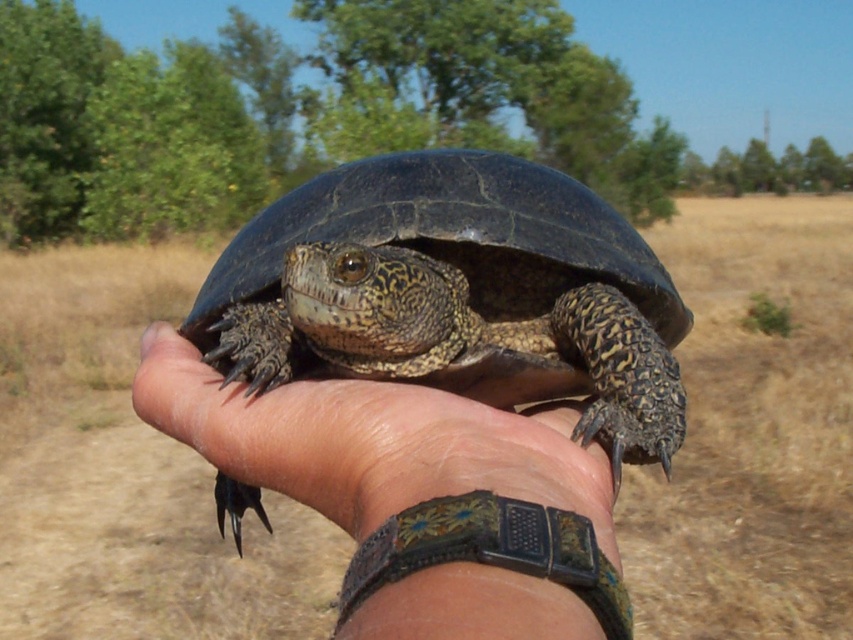
Is shiny dark shell turtle at center closer to the viewer compared to leather wristwatch at center?

No, it is not.

The width and height of the screenshot is (853, 640). I want to click on shiny dark shell turtle at center, so click(456, 292).